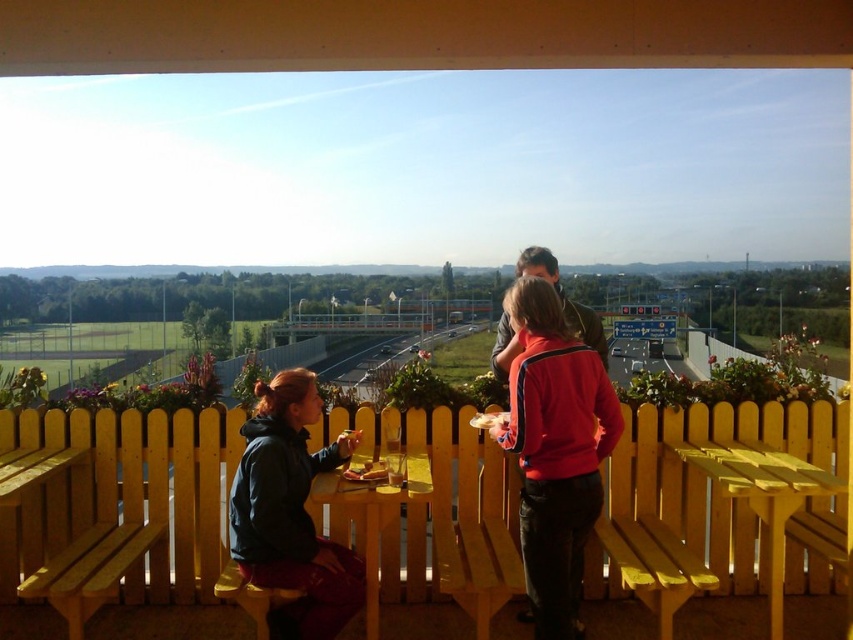
Is point (54, 433) more distant than point (650, 483)?

No.

Image resolution: width=853 pixels, height=640 pixels. Identify the location of yellow wood bench at lower left. (79, 525).

Who is more forward, (67, 604) or (654, 449)?

Point (67, 604) is in front.

Where is `yellow wood bench at lower left`? yellow wood bench at lower left is located at coordinates (79, 525).

Between point (84, 547) and point (431, 492), which one is positioned behind?

The point (84, 547) is behind.

Can you confirm if yellow wood bench at lower left is positioned to the right of wooden picnic table at center?

No, yellow wood bench at lower left is not to the right of wooden picnic table at center.

Is point (136, 496) more distant than point (421, 480)?

Yes, point (136, 496) is behind point (421, 480).

The width and height of the screenshot is (853, 640). I want to click on yellow wood bench at lower left, so click(x=79, y=525).

Measure the distance from yellow wood bench at lower left to yellow wooden picnic table at lower right.

The distance of yellow wood bench at lower left from yellow wooden picnic table at lower right is 10.87 feet.

Is point (90, 589) positioned in front of point (790, 481)?

No, it is behind (790, 481).

Identify the location of yellow wood bench at lower left. (79, 525).